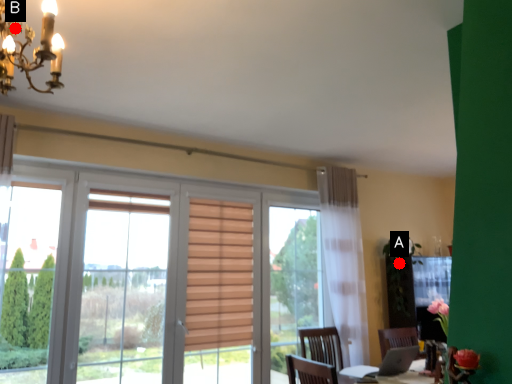
Question: Two points are circled on the image, labeled by A and B beside each circle. Which point is closer to the camera?

Choices:
 (A) A is closer
 (B) B is closer

Answer: (B)